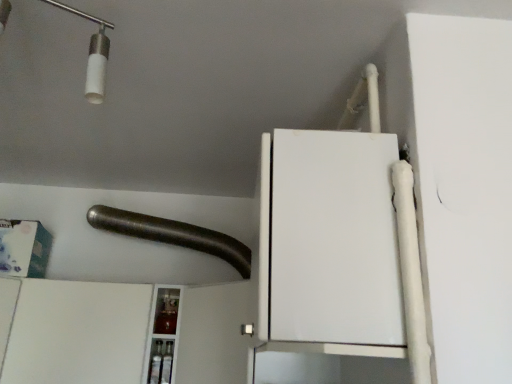
The image size is (512, 384). In order to click on brushed metal pipe at upper center in this screenshot , I will do `click(173, 235)`.

The width and height of the screenshot is (512, 384). What do you see at coordinates (173, 235) in the screenshot?
I see `brushed metal pipe at upper center` at bounding box center [173, 235].

What is the approximate width of brushed metal pipe at upper center?

The width of brushed metal pipe at upper center is 51.61 centimeters.

What do you see at coordinates (77, 333) in the screenshot? This screenshot has height=384, width=512. I see `white matte cabinet at lower left` at bounding box center [77, 333].

Where is `white matte cabinet at lower left`? This screenshot has width=512, height=384. white matte cabinet at lower left is located at coordinates (77, 333).

What is the approximate width of white matte cabinet at lower left?

white matte cabinet at lower left is 33.91 centimeters in width.

Find the location of a particular element. brushed metal pipe at upper center is located at coordinates (173, 235).

Considering the relative positions of white matte cabinet at lower left and brushed metal pipe at upper center in the image provided, is white matte cabinet at lower left to the left or to the right of brushed metal pipe at upper center?

Based on their positions, white matte cabinet at lower left is located to the left of brushed metal pipe at upper center.

Considering the positions of objects white matte cabinet at lower left and brushed metal pipe at upper center in the image provided, who is behind, white matte cabinet at lower left or brushed metal pipe at upper center?

brushed metal pipe at upper center is more distant.

Considering the points (38, 282) and (195, 248), which point is in front, point (38, 282) or point (195, 248)?

The point (38, 282) is in front.

From the image's perspective, is white matte cabinet at lower left located above or below brushed metal pipe at upper center?

Clearly, from the image's perspective, white matte cabinet at lower left is below brushed metal pipe at upper center.

In the scene shown: From a real-world perspective, is white matte cabinet at lower left under brushed metal pipe at upper center?

Yes, from a real-world perspective, white matte cabinet at lower left is beneath brushed metal pipe at upper center.

In the scene shown: Which object is wider, white matte cabinet at lower left or brushed metal pipe at upper center?

With larger width is brushed metal pipe at upper center.

Who is shorter, white matte cabinet at lower left or brushed metal pipe at upper center?

brushed metal pipe at upper center.

Based on their sizes in the image, would you say white matte cabinet at lower left is bigger or smaller than brushed metal pipe at upper center?

Considering their sizes, white matte cabinet at lower left takes up more space than brushed metal pipe at upper center.

Can we say white matte cabinet at lower left lies outside brushed metal pipe at upper center?

Yes, white matte cabinet at lower left is located beyond the bounds of brushed metal pipe at upper center.

Is the surface of white matte cabinet at lower left in direct contact with brushed metal pipe at upper center?

No, white matte cabinet at lower left is not with brushed metal pipe at upper center.

Is white matte cabinet at lower left oriented away from brushed metal pipe at upper center?

No, white matte cabinet at lower left's orientation is not away from brushed metal pipe at upper center.

How different are the orientations of white matte cabinet at lower left and brushed metal pipe at upper center in degrees?

They differ by 0.000232 degrees in their facing directions.

Identify the location of beam above the white matte cabinet at lower left (from the image's perspective). (173, 235).

Is brushed metal pipe at upper center to the left or to the right of white matte cabinet at lower left in the image?

Based on their positions, brushed metal pipe at upper center is located to the right of white matte cabinet at lower left.

Who is more distant, brushed metal pipe at upper center or white matte cabinet at lower left?

brushed metal pipe at upper center is more distant.

Which is nearer, (239, 272) or (88, 334)?

The point (88, 334) is in front.

From the image's perspective, is brushed metal pipe at upper center over white matte cabinet at lower left?

Yes, from the image's perspective, brushed metal pipe at upper center is above white matte cabinet at lower left.

From a real-world perspective, between brushed metal pipe at upper center and white matte cabinet at lower left, who is vertically lower?

white matte cabinet at lower left.

Between brushed metal pipe at upper center and white matte cabinet at lower left, which one has smaller width?

white matte cabinet at lower left is thinner.

Is brushed metal pipe at upper center taller than white matte cabinet at lower left?

No, brushed metal pipe at upper center is not taller than white matte cabinet at lower left.

Can you confirm if brushed metal pipe at upper center is bigger than white matte cabinet at lower left?

No.

Is brushed metal pipe at upper center surrounding white matte cabinet at lower left?

That's incorrect, white matte cabinet at lower left is not inside brushed metal pipe at upper center.

Is brushed metal pipe at upper center next to white matte cabinet at lower left and touching it?

brushed metal pipe at upper center and white matte cabinet at lower left are not in contact.

Is brushed metal pipe at upper center turned away from white matte cabinet at lower left?

No, brushed metal pipe at upper center is not facing away from white matte cabinet at lower left.

What's the angular difference between brushed metal pipe at upper center and white matte cabinet at lower left's facing directions?

0.000232 degrees separate the facing orientations of brushed metal pipe at upper center and white matte cabinet at lower left.

Measure the distance between brushed metal pipe at upper center and white matte cabinet at lower left.

brushed metal pipe at upper center and white matte cabinet at lower left are 45.83 centimeters apart.

Where is `beam above the white matte cabinet at lower left (from the image's perspective)`? The width and height of the screenshot is (512, 384). beam above the white matte cabinet at lower left (from the image's perspective) is located at coordinates (173, 235).

The height and width of the screenshot is (384, 512). In order to click on cabinetry in front of the brushed metal pipe at upper center in this screenshot , I will do `click(77, 333)`.

At what (x,y) coordinates should I click in order to perform the action: click on beam that appears behind the white matte cabinet at lower left. Please return your answer as a coordinate pair (x, y). The height and width of the screenshot is (384, 512). Looking at the image, I should click on (173, 235).